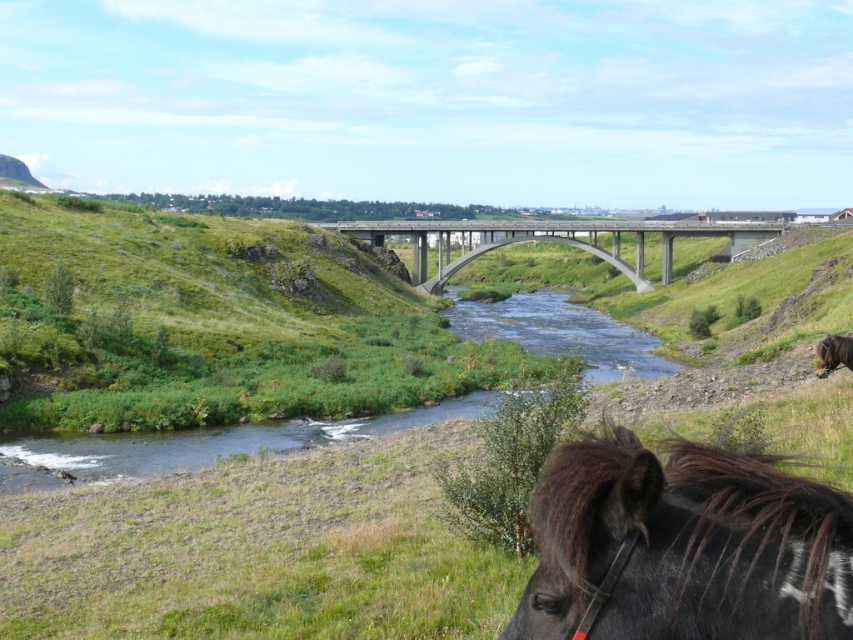
Question: Estimate the real-world distances between objects in this image. Which object is closer to the green grassy at center?

Choices:
 (A) concrete bridge at center
 (B) black glossy horse at lower right
 (C) brown fuzzy horse at lower right

Answer: (B)

Question: Which point is farther to the camera?

Choices:
 (A) (666, 612)
 (B) (436, 266)

Answer: (B)

Question: Can you confirm if concrete bridge at center is wider than brown fuzzy horse at lower right?

Choices:
 (A) yes
 (B) no

Answer: (A)

Question: Is black glossy horse at lower right below brown fuzzy horse at lower right?

Choices:
 (A) yes
 (B) no

Answer: (B)

Question: Which point is farther from the camera taking this photo?

Choices:
 (A) (373, 241)
 (B) (560, 552)
 (C) (44, 525)
 (D) (825, 337)

Answer: (A)

Question: Is the position of green grassy at center less distant than that of concrete bridge at center?

Choices:
 (A) no
 (B) yes

Answer: (B)